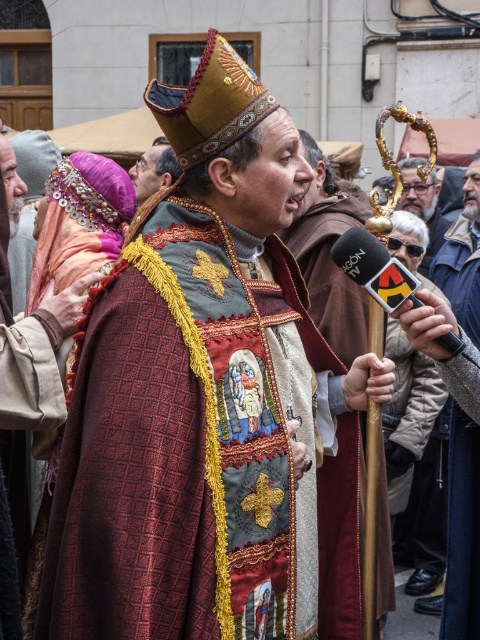
You are a photographer at the event and need to capture a closeup shot of both the velvet gold staff at center and the matte black microphone at center. Since your camera can only focus on one object at a time, which object should you focus on to ensure the larger one is in clear view?

The velvet gold staff at center is larger in size than the matte black microphone at center, so you should focus on the velvet gold staff at center to ensure the larger one is in clear view.

You are a photographer at the event and want to capture a photo where both the velvet brown robe at center and the matte black microphone at center are clearly visible. Based on their positions, which object should you focus on first to ensure both are in frame?

The velvet brown robe at center is positioned under the matte black microphone at center. To ensure both are in frame, focus on the matte black microphone at center first since it is above the robe and part of the same vertical line, allowing the robe to naturally fall into the shot below.

You are a photographer at the event and want to capture a clear photo of both the velvet brown robe at center and the matte black microphone at center. Since the microphone is smaller, will you need to adjust your camera angle to ensure both are in frame?

The velvet brown robe at center is much taller than the matte black microphone at center, so you will need to adjust your camera angle to ensure both are in frame, focusing on the height difference between them.